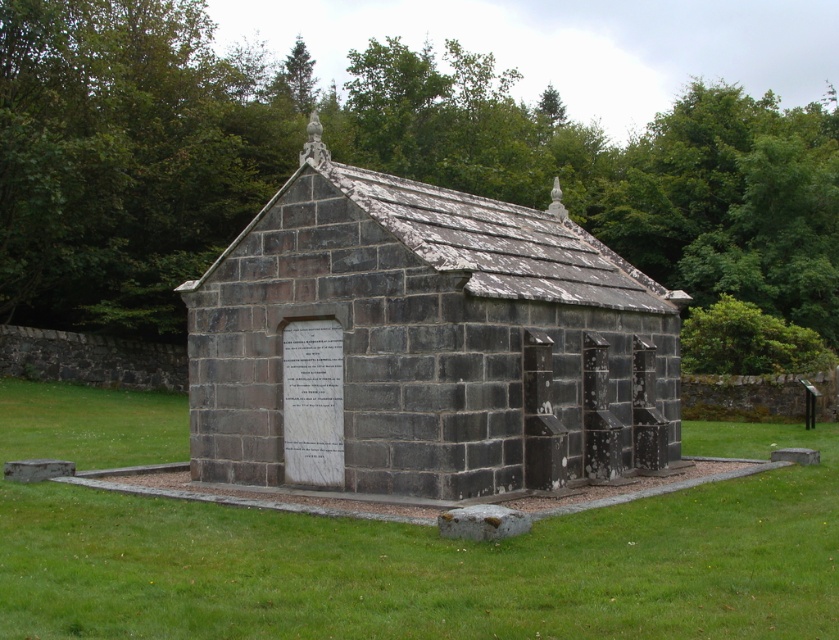
Is green leafy tree at center below dark gray stone church at center?

Actually, green leafy tree at center is above dark gray stone church at center.

I want to click on green leafy tree at center, so click(367, 163).

Locate an element on the screen. This screenshot has width=839, height=640. green leafy tree at center is located at coordinates (367, 163).

Is green leafy tree at center closer to camera compared to green grass at lower center?

No.

Is green leafy tree at center wider than green grass at lower center?

Indeed, green leafy tree at center has a greater width compared to green grass at lower center.

Where is `green leafy tree at center`? This screenshot has width=839, height=640. green leafy tree at center is located at coordinates (367, 163).

Who is more forward, (x=186, y=312) or (x=498, y=579)?

Positioned in front is point (x=498, y=579).

Is dark gray stone church at center bigger than green grass at lower center?

Correct, dark gray stone church at center is larger in size than green grass at lower center.

Image resolution: width=839 pixels, height=640 pixels. Describe the element at coordinates (425, 344) in the screenshot. I see `dark gray stone church at center` at that location.

Locate an element on the screen. Image resolution: width=839 pixels, height=640 pixels. dark gray stone church at center is located at coordinates [x=425, y=344].